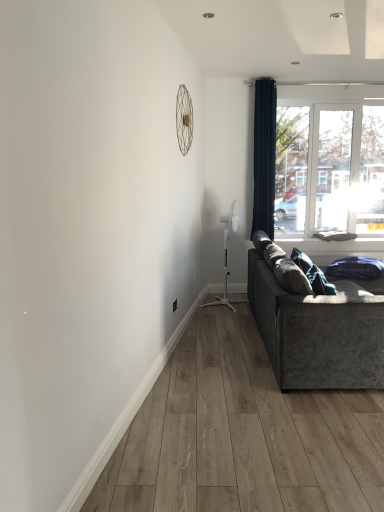
What is the approximate width of white plastic mechanical fan at center-right, placed as the 1th mechanical fan when sorted from right to left?

white plastic mechanical fan at center-right, placed as the 1th mechanical fan when sorted from right to left, is 17.84 inches in width.

This screenshot has height=512, width=384. Identify the location of transparent glass window at upper right. (330, 161).

Locate an element on the screen. navy velvet curtain at upper right is located at coordinates (264, 156).

The width and height of the screenshot is (384, 512). Describe the element at coordinates (318, 332) in the screenshot. I see `velvet grey couch at right` at that location.

At what (x,y) coordinates should I click in order to perform the action: click on velvet blue pillow at lower right. Please return your answer as a coordinate pair (x, y). The width and height of the screenshot is (384, 512). Looking at the image, I should click on (313, 274).

Which is in front, point (347, 162) or point (272, 103)?

The point (272, 103) is closer to the camera.

From the image's perspective, does transparent glass window at upper right appear lower than navy velvet curtain at upper right?

Indeed, from the image's perspective, transparent glass window at upper right is shown beneath navy velvet curtain at upper right.

Choose the correct answer: Is transparent glass window at upper right inside navy velvet curtain at upper right or outside it?

The correct answer is: outside.

Are transparent glass window at upper right and velvet blue pillow at lower right located far from each other?

Yes, transparent glass window at upper right and velvet blue pillow at lower right are quite far apart.

Which point is more forward, (282, 147) or (328, 286)?

The point (328, 286) is closer.

Is transparent glass window at upper right aimed at velvet blue pillow at lower right?

Yes, transparent glass window at upper right faces towards velvet blue pillow at lower right.

Looking at this image, which is correct: transparent glass window at upper right is inside velvet blue pillow at lower right, or outside of it?

The correct answer is: outside.

Between transparent glass window at upper right and velvet grey couch at right, which one appears on the left side from the viewer's perspective?

Positioned to the left is velvet grey couch at right.

In the scene shown: From the image's perspective, is transparent glass window at upper right located above or below velvet grey couch at right?

From the image's perspective, transparent glass window at upper right appears above velvet grey couch at right.

Between transparent glass window at upper right and velvet grey couch at right, which one has smaller width?

transparent glass window at upper right is thinner.

Is velvet blue pillow at lower right taller than metallic wire at upper center, which is the 2th mechanical fan in right-to-left order?

In fact, velvet blue pillow at lower right may be shorter than metallic wire at upper center, which is the 2th mechanical fan in right-to-left order.

Between point (302, 264) and point (184, 97), which one is positioned behind?

The point (184, 97) is farther.

From the image's perspective, is velvet blue pillow at lower right below metallic wire at upper center, which is the 2th mechanical fan in right-to-left order?

Correct, velvet blue pillow at lower right appears lower than metallic wire at upper center, which is the 2th mechanical fan in right-to-left order, in the image.

From the image's perspective, does white plastic mechanical fan at center-right, arranged as the 2th mechanical fan when viewed from the front, appear lower than navy velvet curtain at upper right?

Yes.

Considering the relative sizes of white plastic mechanical fan at center-right, positioned as the 1th mechanical fan in bottom-to-top order, and navy velvet curtain at upper right in the image provided, is white plastic mechanical fan at center-right, positioned as the 1th mechanical fan in bottom-to-top order, bigger than navy velvet curtain at upper right?

Indeed, white plastic mechanical fan at center-right, positioned as the 1th mechanical fan in bottom-to-top order, has a larger size compared to navy velvet curtain at upper right.

Who is shorter, white plastic mechanical fan at center-right, which is counted as the 2th mechanical fan, starting from the top, or navy velvet curtain at upper right?

white plastic mechanical fan at center-right, which is counted as the 2th mechanical fan, starting from the top.

From a real-world perspective, is white plastic mechanical fan at center-right, the second mechanical fan positioned from the left, above or below navy velvet curtain at upper right?

white plastic mechanical fan at center-right, the second mechanical fan positioned from the left, is situated lower than navy velvet curtain at upper right in the real world.

Is velvet blue pillow at lower right to the right of velvet grey couch at right from the viewer's perspective?

In fact, velvet blue pillow at lower right is to the left of velvet grey couch at right.

Is velvet blue pillow at lower right looking in the opposite direction of velvet grey couch at right?

Yes, velvet blue pillow at lower right is facing away from velvet grey couch at right.

From a real-world perspective, which is physically below, velvet blue pillow at lower right or velvet grey couch at right?

From a 3D spatial view, velvet grey couch at right is below.

Measure the distance from velvet blue pillow at lower right to velvet grey couch at right.

A distance of 12.24 inches exists between velvet blue pillow at lower right and velvet grey couch at right.

Consider the image. Measure the distance from transparent glass window at upper right to white plastic mechanical fan at center-right, arranged as the 2th mechanical fan when viewed from the front.

1.57 meters.

Is transparent glass window at upper right oriented away from white plastic mechanical fan at center-right, arranged as the 2th mechanical fan when viewed from the front?

transparent glass window at upper right does not have its back to white plastic mechanical fan at center-right, arranged as the 2th mechanical fan when viewed from the front.

Would you say transparent glass window at upper right is outside white plastic mechanical fan at center-right, placed as the 1th mechanical fan when sorted from right to left?

transparent glass window at upper right lies outside white plastic mechanical fan at center-right, placed as the 1th mechanical fan when sorted from right to left,'s area.

Can you confirm if transparent glass window at upper right is shorter than white plastic mechanical fan at center-right, placed as the 1th mechanical fan when sorted from right to left?

No.

The image size is (384, 512). In order to click on window that appears on the right of navy velvet curtain at upper right in this screenshot , I will do `click(330, 161)`.

This screenshot has height=512, width=384. I want to click on pillow below the transparent glass window at upper right (from the image's perspective), so click(x=313, y=274).

Consider the image. Looking at the image, which one is located further to navy velvet curtain at upper right, metallic wire at upper center, arranged as the second mechanical fan when viewed from the back, or transparent glass window at upper right?

metallic wire at upper center, arranged as the second mechanical fan when viewed from the back.

Estimate the real-world distances between objects in this image. Which object is closer to velvet blue pillow at lower right, white plastic mechanical fan at center-right, positioned as the 1th mechanical fan in bottom-to-top order, or transparent glass window at upper right?

Based on the image, white plastic mechanical fan at center-right, positioned as the 1th mechanical fan in bottom-to-top order, appears to be nearer to velvet blue pillow at lower right.

From the image, which object appears to be farther from navy velvet curtain at upper right, transparent glass window at upper right or white plastic mechanical fan at center-right, placed as the 1th mechanical fan when sorted from right to left?

transparent glass window at upper right is positioned further to the anchor navy velvet curtain at upper right.

From the image, which object appears to be nearer to white plastic mechanical fan at center-right, the second mechanical fan positioned from the left, velvet blue pillow at lower right or velvet grey couch at right?

Based on the image, velvet blue pillow at lower right appears to be nearer to white plastic mechanical fan at center-right, the second mechanical fan positioned from the left.

When comparing their distances from metallic wire at upper center, which appears as the 1th mechanical fan when viewed from the front, does velvet blue pillow at lower right or navy velvet curtain at upper right seem further?

Among the two, velvet blue pillow at lower right is located further to metallic wire at upper center, which appears as the 1th mechanical fan when viewed from the front.

Based on their spatial positions, is white plastic mechanical fan at center-right, positioned as the 1th mechanical fan in bottom-to-top order, or velvet blue pillow at lower right closer to transparent glass window at upper right?

white plastic mechanical fan at center-right, positioned as the 1th mechanical fan in bottom-to-top order, is closer to transparent glass window at upper right.

Which object lies further to the anchor point metallic wire at upper center, which appears as the 1th mechanical fan when viewed from the front, navy velvet curtain at upper right or white plastic mechanical fan at center-right, the 1th mechanical fan viewed from the back?

white plastic mechanical fan at center-right, the 1th mechanical fan viewed from the back.

Which object lies nearer to the anchor point transparent glass window at upper right, velvet blue pillow at lower right or velvet grey couch at right?

velvet blue pillow at lower right.

Where is `pillow between velvet grey couch at right and navy velvet curtain at upper right along the z-axis`? The height and width of the screenshot is (512, 384). pillow between velvet grey couch at right and navy velvet curtain at upper right along the z-axis is located at coordinates (313, 274).

At what (x,y) coordinates should I click in order to perform the action: click on curtain between velvet blue pillow at lower right and transparent glass window at upper right along the z-axis. Please return your answer as a coordinate pair (x, y). The width and height of the screenshot is (384, 512). Looking at the image, I should click on (264, 156).

What are the coordinates of `pillow located between velvet grey couch at right and transparent glass window at upper right in the depth direction` in the screenshot? It's located at (313, 274).

This screenshot has width=384, height=512. Find the location of `mechanical fan between velvet grey couch at right and white plastic mechanical fan at center-right, placed as the 1th mechanical fan when sorted from right to left, in the front-back direction`. mechanical fan between velvet grey couch at right and white plastic mechanical fan at center-right, placed as the 1th mechanical fan when sorted from right to left, in the front-back direction is located at coordinates (184, 119).